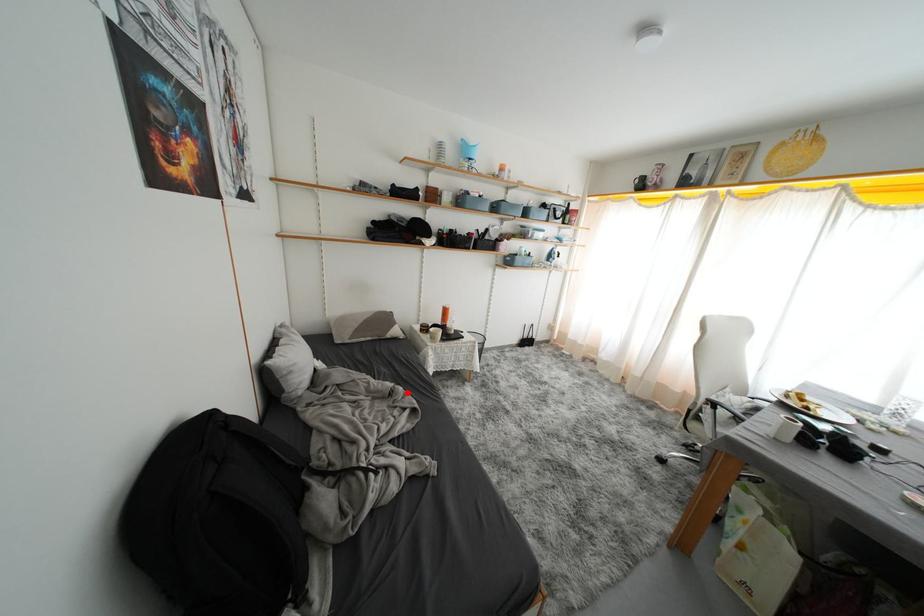
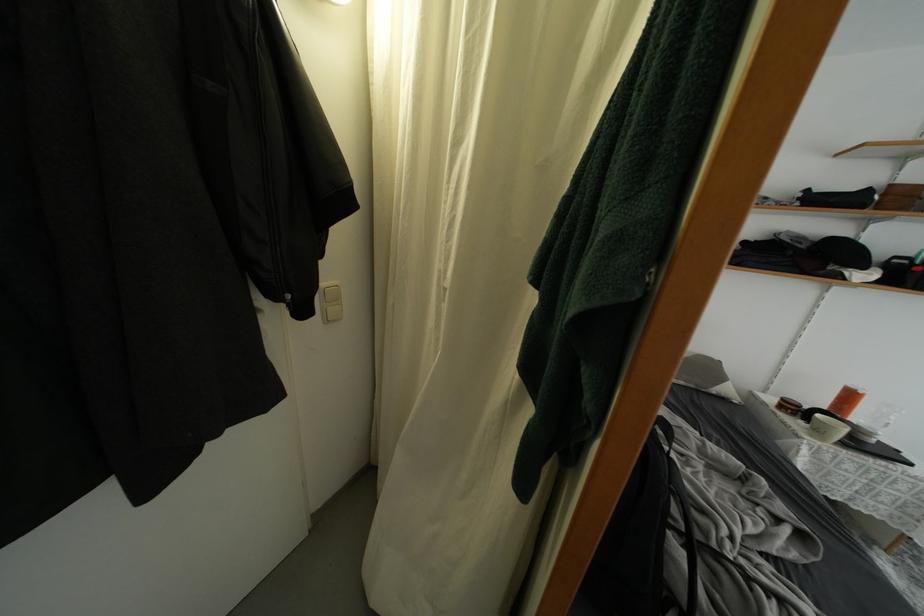
Question: I am providing you with two images of the same scene from different viewpoints. A red point is shown in image1. For the corresponding object point in image2, is it positioned nearer or farther from the camera?

Choices:
 (A) Nearer
 (B) Farther

Answer: (B)